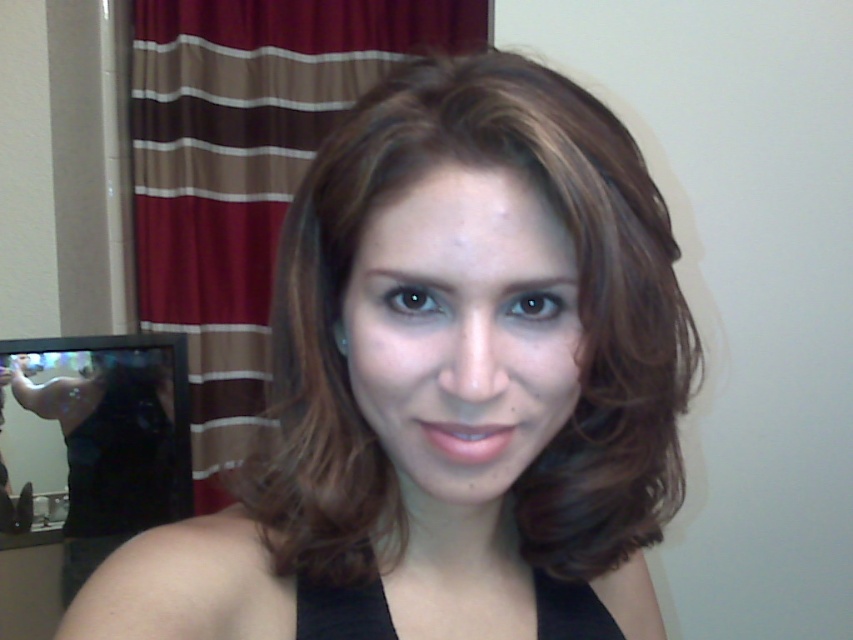
Does black reflective mirror at left appear over black satin dress at center?

Actually, black reflective mirror at left is below black satin dress at center.

Who is more forward, (78, 444) or (386, 596)?

Point (386, 596) is in front.

Locate an element on the screen. black reflective mirror at left is located at coordinates (91, 436).

Is black satin dress at lower left below black satin dress at center?

Yes.

Measure the distance between black satin dress at lower left and camera.

5.14 feet

The height and width of the screenshot is (640, 853). Find the location of `black satin dress at lower left`. black satin dress at lower left is located at coordinates (115, 465).

Between brown striped curtain at upper center and black satin dress at lower left, which one is positioned lower?

black satin dress at lower left is lower down.

This screenshot has width=853, height=640. What do you see at coordinates (244, 170) in the screenshot? I see `brown striped curtain at upper center` at bounding box center [244, 170].

Image resolution: width=853 pixels, height=640 pixels. Find the location of `brown striped curtain at upper center`. brown striped curtain at upper center is located at coordinates (244, 170).